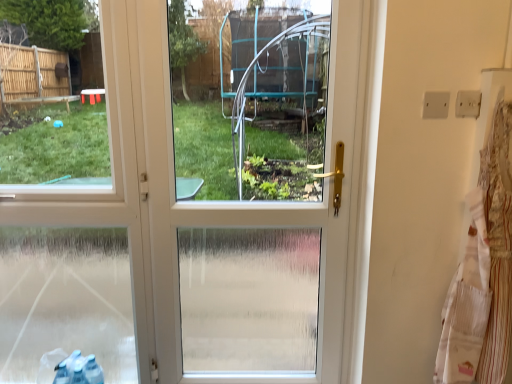
What do you see at coordinates (258, 112) in the screenshot?
I see `white plastic screen door at center` at bounding box center [258, 112].

Locate an element on the screen. The image size is (512, 384). white plastic screen door at center is located at coordinates (258, 112).

In order to face white striped laundry at right, should I rotate leftwards or rightwards?

You should rotate right by 30.000 degrees.

This screenshot has height=384, width=512. In order to click on white striped laundry at right in this screenshot , I will do `click(483, 273)`.

The image size is (512, 384). Describe the element at coordinates (483, 273) in the screenshot. I see `white striped laundry at right` at that location.

Where is `white plastic screen door at center`? white plastic screen door at center is located at coordinates (258, 112).

In the image, is white striped laundry at right on the left side or the right side of white plastic screen door at center?

Based on their positions, white striped laundry at right is located to the right of white plastic screen door at center.

Which object is further away from the camera, white striped laundry at right or white plastic screen door at center?

Positioned behind is white plastic screen door at center.

Does point (463, 315) come behind point (181, 40)?

No, it is in front of (181, 40).

Looking at this image, from the image's perspective, is white striped laundry at right located above or below white plastic screen door at center?

Based on their image positions, white striped laundry at right is located beneath white plastic screen door at center.

In the scene shown: From a real-world perspective, who is located lower, white striped laundry at right or white plastic screen door at center?

In real-world perspective, white striped laundry at right is lower.

Which object is wider, white striped laundry at right or white plastic screen door at center?

white plastic screen door at center.

In the scene shown: Does white striped laundry at right have a lesser height compared to white plastic screen door at center?

Yes, white striped laundry at right is shorter than white plastic screen door at center.

Who is smaller, white striped laundry at right or white plastic screen door at center?

white striped laundry at right.

Choose the correct answer: Is white striped laundry at right inside white plastic screen door at center or outside it?

white striped laundry at right lies outside white plastic screen door at center.

Based on the photo, would you consider white striped laundry at right to be distant from white plastic screen door at center?

No, white striped laundry at right is in close proximity to white plastic screen door at center.

Could you tell me if white striped laundry at right is facing white plastic screen door at center?

No, white striped laundry at right is not aimed at white plastic screen door at center.

What's the angular difference between white striped laundry at right and white plastic screen door at center's facing directions?

The facing directions of white striped laundry at right and white plastic screen door at center are 0.00546 degrees apart.

How much distance is there between white striped laundry at right and white plastic screen door at center?

white striped laundry at right is 89.88 centimeters away from white plastic screen door at center.

The width and height of the screenshot is (512, 384). Identify the location of laundry located in front of the white plastic screen door at center. (483, 273).

In the scene shown: Which object is positioned more to the right, white plastic screen door at center or white striped laundry at right?

white striped laundry at right is more to the right.

Is white plastic screen door at center further to camera compared to white striped laundry at right?

Yes, it is behind white striped laundry at right.

Is point (189, 319) more distant than point (480, 250)?

Yes, point (189, 319) is farther from viewer.

From the image's perspective, which is above, white plastic screen door at center or white striped laundry at right?

white plastic screen door at center is shown above in the image.

From a real-world perspective, which is physically below, white plastic screen door at center or white striped laundry at right?

white striped laundry at right is physically lower.

Does white plastic screen door at center have a greater width compared to white striped laundry at right?

Indeed, white plastic screen door at center has a greater width compared to white striped laundry at right.

Based on the photo, can you confirm if white plastic screen door at center is taller than white striped laundry at right?

Indeed, white plastic screen door at center has a greater height compared to white striped laundry at right.

Considering the sizes of white plastic screen door at center and white striped laundry at right in the image, is white plastic screen door at center bigger or smaller than white striped laundry at right?

Considering their sizes, white plastic screen door at center takes up more space than white striped laundry at right.

Is white plastic screen door at center not within white striped laundry at right?

Yes, white plastic screen door at center is located beyond the bounds of white striped laundry at right.

Are white plastic screen door at center and white striped laundry at right located far from each other?

That's not correct — white plastic screen door at center is a little close to white striped laundry at right.

Is white plastic screen door at center oriented away from white striped laundry at right?

No, white plastic screen door at center is not facing the opposite direction of white striped laundry at right.

What are the coordinates of `screen door behind the white striped laundry at right` in the screenshot? It's located at (x=258, y=112).

The width and height of the screenshot is (512, 384). Find the location of `screen door lying above the white striped laundry at right (from the image's perspective)`. screen door lying above the white striped laundry at right (from the image's perspective) is located at coordinates (258, 112).

Identify the location of laundry in front of the white plastic screen door at center. (483, 273).